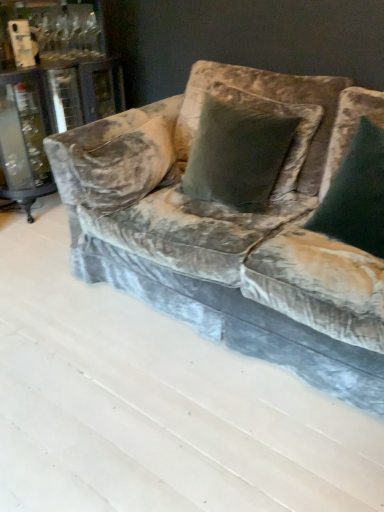
The width and height of the screenshot is (384, 512). In order to click on velvet green pillow at center, the second pillow positioned from the right in this screenshot , I will do `click(248, 148)`.

At what (x,y) coordinates should I click in order to perform the action: click on velvet couch at center. Please return your answer as a coordinate pair (x, y). Looking at the image, I should click on (227, 236).

Based on their sizes in the image, would you say velvet couch at center is bigger or smaller than dark green velvet pillow at center, which is counted as the first pillow, starting from the right?

Considering their sizes, velvet couch at center takes up more space than dark green velvet pillow at center, which is counted as the first pillow, starting from the right.

Is velvet couch at center next to dark green velvet pillow at center, which is counted as the first pillow, starting from the right, and touching it?

No, velvet couch at center is not touching dark green velvet pillow at center, which is counted as the first pillow, starting from the right.

In the image, is velvet couch at center on the left side or the right side of dark green velvet pillow at center, which appears as the second pillow when viewed from the left?

From the image, it's evident that velvet couch at center is to the left of dark green velvet pillow at center, which appears as the second pillow when viewed from the left.

Based on the photo, considering the sizes of velvet couch at center and dark green velvet pillow at center, which appears as the second pillow when viewed from the left, in the image, is velvet couch at center taller or shorter than dark green velvet pillow at center, which appears as the second pillow when viewed from the left,?

Clearly, velvet couch at center is shorter compared to dark green velvet pillow at center, which appears as the second pillow when viewed from the left.

Which is behind, point (218, 85) or point (373, 161)?

Positioned behind is point (218, 85).

Based on the photo, who is shorter, velvet green pillow at center, which is the first pillow in left-to-right order, or dark green velvet pillow at center, which appears as the second pillow when viewed from the left?

velvet green pillow at center, which is the first pillow in left-to-right order.

Is velvet green pillow at center, the second pillow positioned from the right, not inside dark green velvet pillow at center, which is counted as the first pillow, starting from the right?

Yes, velvet green pillow at center, the second pillow positioned from the right, is located beyond the bounds of dark green velvet pillow at center, which is counted as the first pillow, starting from the right.

Is velvet couch at center behind velvet green pillow at center, the second pillow positioned from the right?

No, the depth of velvet couch at center is less than that of velvet green pillow at center, the second pillow positioned from the right.

Is velvet couch at center in contact with velvet green pillow at center, which is the first pillow in left-to-right order?

There is a gap between velvet couch at center and velvet green pillow at center, which is the first pillow in left-to-right order.

Is velvet couch at center surrounding velvet green pillow at center, the second pillow positioned from the right?

No, velvet green pillow at center, the second pillow positioned from the right, is not inside velvet couch at center.

Is velvet couch at center oriented away from velvet green pillow at center, the second pillow positioned from the right?

No, velvet couch at center's orientation is not away from velvet green pillow at center, the second pillow positioned from the right.

Considering the relative sizes of dark green velvet pillow at center, which is counted as the first pillow, starting from the right, and velvet couch at center in the image provided, is dark green velvet pillow at center, which is counted as the first pillow, starting from the right, smaller than velvet couch at center?

Correct, dark green velvet pillow at center, which is counted as the first pillow, starting from the right, occupies less space than velvet couch at center.

From a real-world perspective, does dark green velvet pillow at center, which appears as the second pillow when viewed from the left, sit lower than velvet couch at center?

No, from a real-world perspective, dark green velvet pillow at center, which appears as the second pillow when viewed from the left, is not beneath velvet couch at center.

From the picture: Is dark green velvet pillow at center, which appears as the second pillow when viewed from the left, in contact with velvet couch at center?

No, dark green velvet pillow at center, which appears as the second pillow when viewed from the left, is not in contact with velvet couch at center.

Is velvet couch at center located within dark green velvet pillow at center, which appears as the second pillow when viewed from the left?

No, velvet couch at center is located outside of dark green velvet pillow at center, which appears as the second pillow when viewed from the left.

Is velvet green pillow at center, which is the first pillow in left-to-right order, shorter than velvet couch at center?

In fact, velvet green pillow at center, which is the first pillow in left-to-right order, may be taller than velvet couch at center.

From the image's perspective, which one is positioned higher, velvet green pillow at center, the second pillow positioned from the right, or velvet couch at center?

velvet green pillow at center, the second pillow positioned from the right, is shown above in the image.

Are velvet green pillow at center, the second pillow positioned from the right, and velvet couch at center located far from each other?

velvet green pillow at center, the second pillow positioned from the right, is near velvet couch at center, not far away.

Where is `the 2nd pillow directly above the velvet couch at center (from a real-world perspective)`? the 2nd pillow directly above the velvet couch at center (from a real-world perspective) is located at coordinates (248, 148).

Consider the image. Which of these two, dark green velvet pillow at center, which is counted as the first pillow, starting from the right, or velvet green pillow at center, the second pillow positioned from the right, is wider?

With larger width is velvet green pillow at center, the second pillow positioned from the right.

Is dark green velvet pillow at center, which appears as the second pillow when viewed from the left, not within velvet green pillow at center, the second pillow positioned from the right?

Yes, dark green velvet pillow at center, which appears as the second pillow when viewed from the left, is located beyond the bounds of velvet green pillow at center, the second pillow positioned from the right.

From a real-world perspective, between dark green velvet pillow at center, which is counted as the first pillow, starting from the right, and velvet green pillow at center, which is the first pillow in left-to-right order, who is vertically higher?

velvet green pillow at center, which is the first pillow in left-to-right order.

From the image's perspective, is dark green velvet pillow at center, which appears as the second pillow when viewed from the left, located above or below velvet green pillow at center, the second pillow positioned from the right?

dark green velvet pillow at center, which appears as the second pillow when viewed from the left, is below velvet green pillow at center, the second pillow positioned from the right.

I want to click on studio couch below the dark green velvet pillow at center, which appears as the second pillow when viewed from the left (from the image's perspective), so click(x=227, y=236).

I want to click on pillow above the dark green velvet pillow at center, which appears as the second pillow when viewed from the left (from the image's perspective), so click(x=248, y=148).

From the image, which object appears to be farther from velvet green pillow at center, the second pillow positioned from the right, dark green velvet pillow at center, which appears as the second pillow when viewed from the left, or velvet couch at center?

Among the two, dark green velvet pillow at center, which appears as the second pillow when viewed from the left, is located further to velvet green pillow at center, the second pillow positioned from the right.

When comparing their distances from velvet couch at center, does dark green velvet pillow at center, which appears as the second pillow when viewed from the left, or velvet green pillow at center, the second pillow positioned from the right, seem further?

dark green velvet pillow at center, which appears as the second pillow when viewed from the left, is positioned further to the anchor velvet couch at center.

From the image, which object appears to be farther from velvet couch at center, velvet green pillow at center, the second pillow positioned from the right, or dark green velvet pillow at center, which appears as the second pillow when viewed from the left?

Among the two, dark green velvet pillow at center, which appears as the second pillow when viewed from the left, is located further to velvet couch at center.

Looking at the image, which one is located closer to velvet green pillow at center, the second pillow positioned from the right, velvet couch at center or dark green velvet pillow at center, which is counted as the first pillow, starting from the right?

The object closer to velvet green pillow at center, the second pillow positioned from the right, is velvet couch at center.

From the picture: Based on their spatial positions, is velvet green pillow at center, the second pillow positioned from the right, or velvet couch at center further from dark green velvet pillow at center, which appears as the second pillow when viewed from the left?

Among the two, velvet couch at center is located further to dark green velvet pillow at center, which appears as the second pillow when viewed from the left.

Based on their spatial positions, is velvet couch at center or velvet green pillow at center, the second pillow positioned from the right, further from dark green velvet pillow at center, which is counted as the first pillow, starting from the right?

The object further to dark green velvet pillow at center, which is counted as the first pillow, starting from the right, is velvet couch at center.

At what (x,y) coordinates should I click in order to perform the action: click on pillow between velvet couch at center and dark green velvet pillow at center, which is counted as the first pillow, starting from the right, from left to right. Please return your answer as a coordinate pair (x, y). This screenshot has height=512, width=384. Looking at the image, I should click on (248, 148).